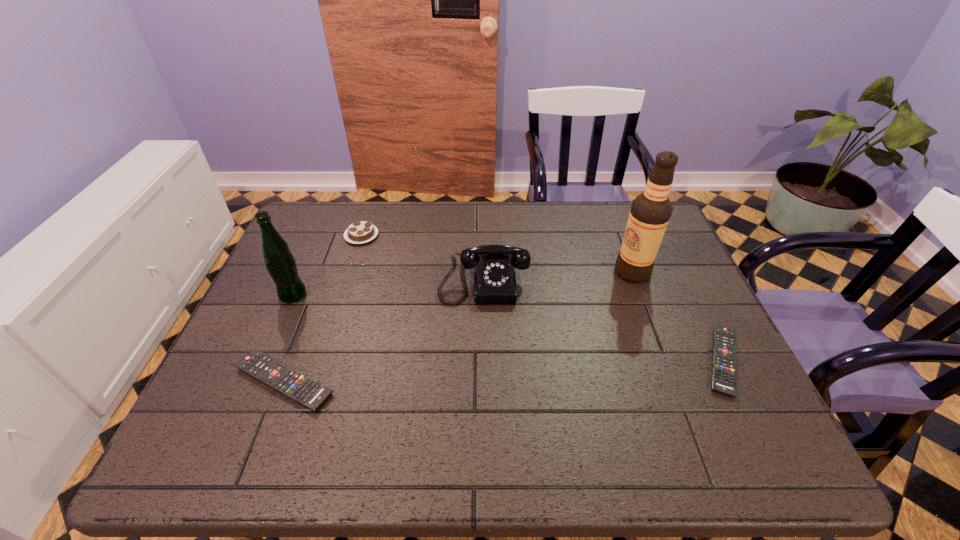
Find the location of a particular element. object that is the fifth closest to the tallest object is located at coordinates (281, 265).

Identify which object is located as the second nearest to the telephone. Please provide its 2D coordinates. Your answer should be formatted as a tuple, i.e. [(x, y)], where the tuple contains the x and y coordinates of a point satisfying the conditions above.

[(650, 212)]

I want to click on vacant position in the image that satisfies the following two spatial constraints: 1. on the label of the tallest object; 2. on the back side of the shortest object, so click(x=665, y=361).

The image size is (960, 540). I want to click on vacant point that satisfies the following two spatial constraints: 1. on the dial of the right remote control; 2. on the left side of the fourth object from left to right, so (x=485, y=361).